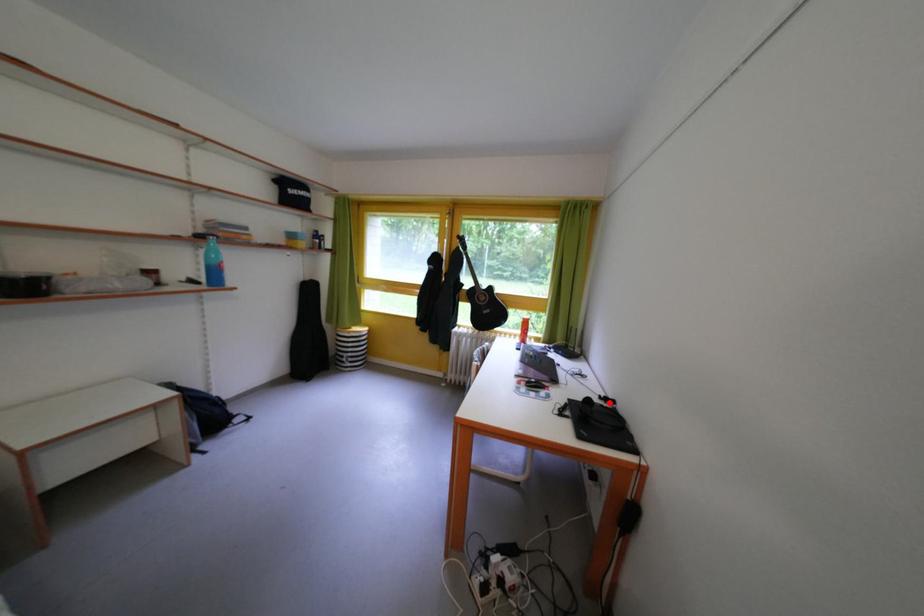
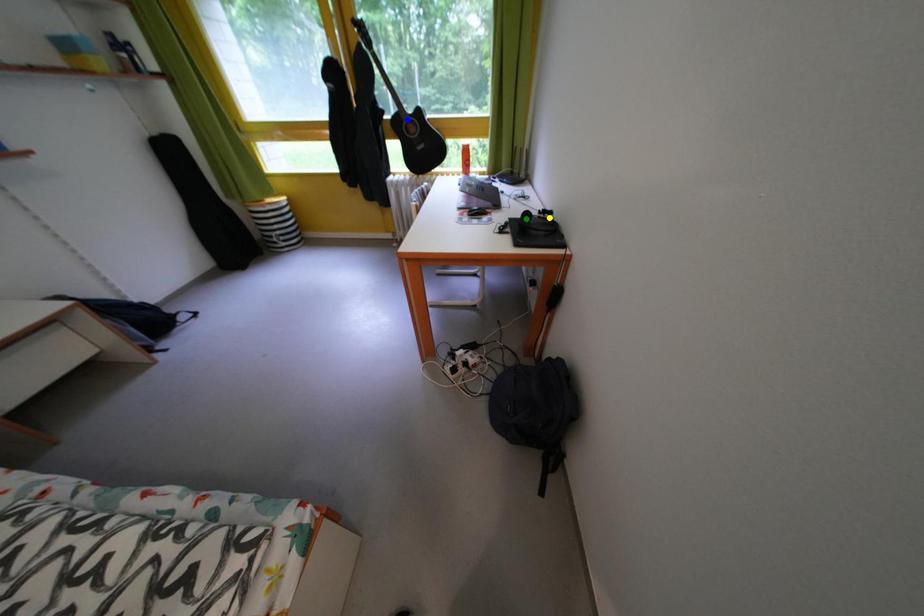
Question: I am providing you with two images of the same scene from different viewpoints. A red point is marked on the first image. You are given multiple points on the second image. In image 2, which mark is for the same physical point as the one in image 1?

Choices:
 (A) blue point
 (B) green point
 (C) yellow point

Answer: (C)